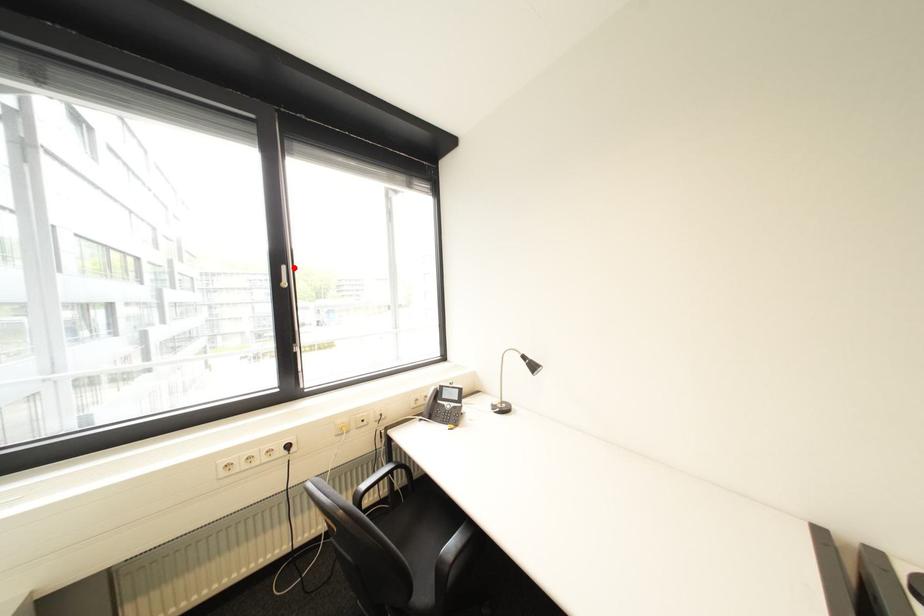
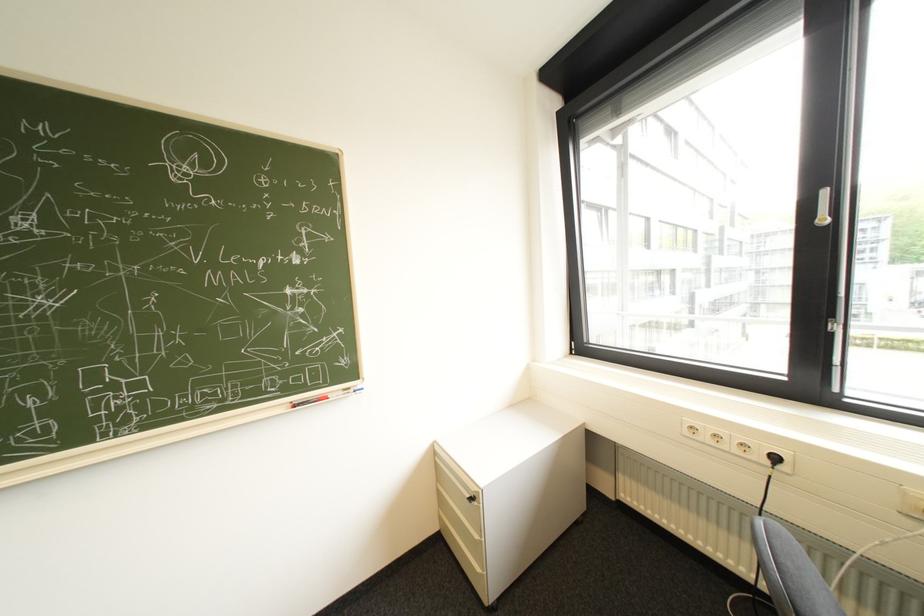
Locate, in the second image, the point that corresponds to the highlighted location in the first image.

(834, 193)